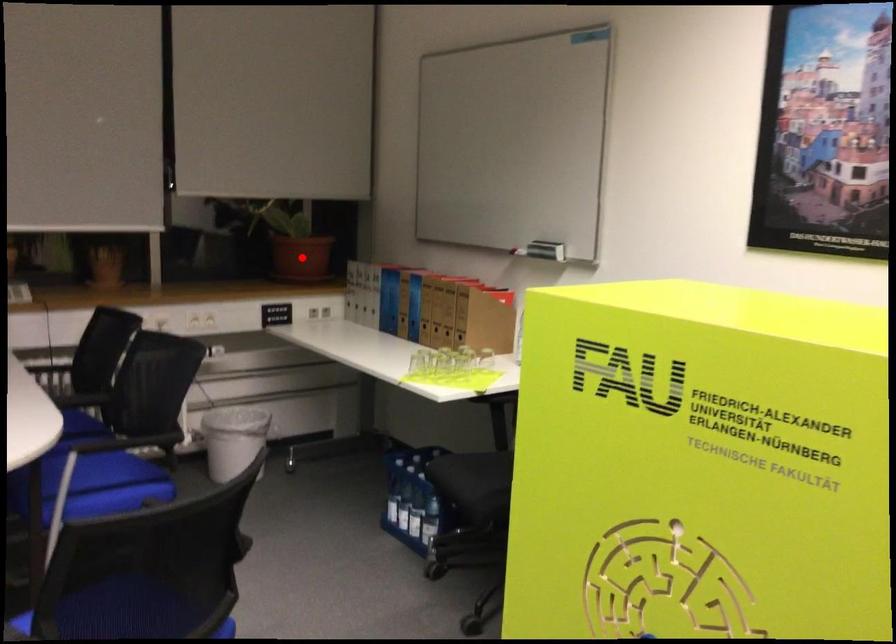
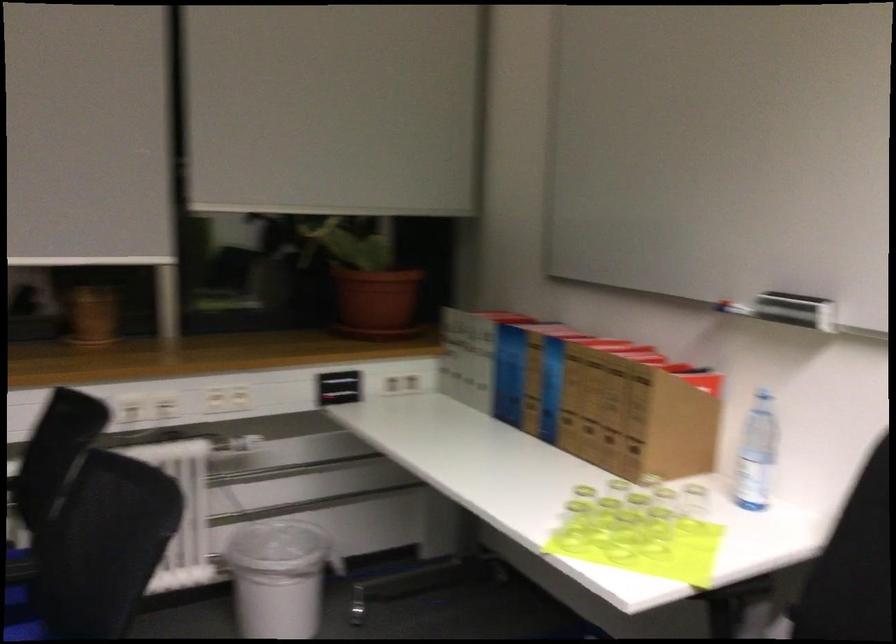
Find the pixel in the second image that matches the highlighted location in the first image.

(375, 303)